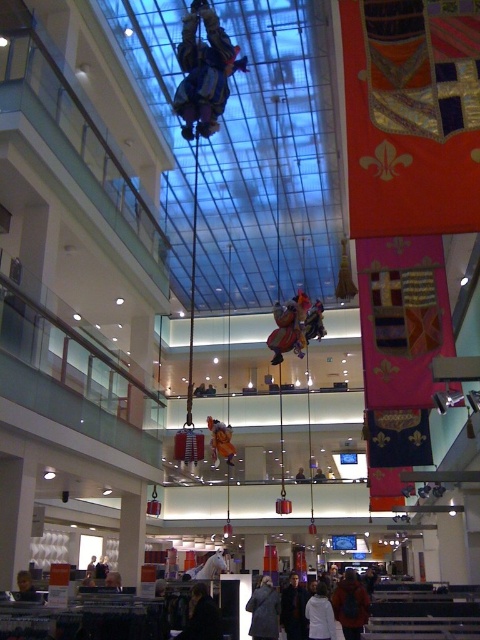
Question: Estimate the real-world distances between objects in this image. Which object is closer to the dark gray wool coat at center?

Choices:
 (A) dark gray jacket at lower center
 (B) dark blue jacket at center

Answer: (B)

Question: Does reflective silver helmet at center appear on the right side of dark gray jacket at center?

Choices:
 (A) no
 (B) yes

Answer: (A)

Question: Which of these objects is positioned closest to the dark gray jacket at center?

Choices:
 (A) dark gray jacket at lower center
 (B) dark gray wool coat at center
 (C) smooth skin face at lower left

Answer: (B)

Question: In this image, where is reflective silver helmet at center located relative to dark blue jacket at center?

Choices:
 (A) above
 (B) below

Answer: (A)

Question: Is dark gray wool coat at center smaller than white matte coat at lower center?

Choices:
 (A) no
 (B) yes

Answer: (B)

Question: Among these objects, which one is farthest from the camera?

Choices:
 (A) dark gray wool coat at center
 (B) white matte coat at lower center
 (C) smooth skin face at lower left
 (D) dark gray jacket at lower center

Answer: (A)